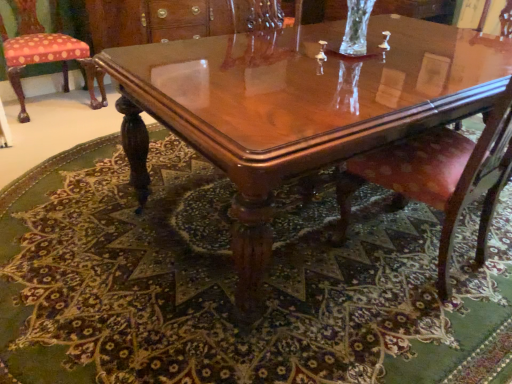
Question: In which direction should I rotate to look at pink velvet chair at center, acting as the second chair starting from the left?

Choices:
 (A) left
 (B) right

Answer: (B)

Question: Does carpeted floor at center have a greater width compared to polka dot fabric cushion at left, which ranks as the second chair in right-to-left order?

Choices:
 (A) yes
 (B) no

Answer: (A)

Question: Is the position of carpeted floor at center less distant than that of polka dot fabric cushion at left, the 2th chair from the front?

Choices:
 (A) yes
 (B) no

Answer: (A)

Question: Can you confirm if carpeted floor at center is thinner than polka dot fabric cushion at left, which appears as the 2th chair when ordered from the bottom?

Choices:
 (A) yes
 (B) no

Answer: (B)

Question: Does carpeted floor at center lie behind polka dot fabric cushion at left, the 1th chair positioned from the left?

Choices:
 (A) yes
 (B) no

Answer: (B)

Question: From a real-world perspective, does carpeted floor at center stand above polka dot fabric cushion at left, the 2th chair from the front?

Choices:
 (A) no
 (B) yes

Answer: (A)

Question: Does carpeted floor at center appear on the right side of polka dot fabric cushion at left, the 1th chair in the back-to-front sequence?

Choices:
 (A) yes
 (B) no

Answer: (A)

Question: Is glossy wood coffee table at center smaller than carpeted floor at center?

Choices:
 (A) yes
 (B) no

Answer: (B)

Question: Is glossy wood coffee table at center bigger than carpeted floor at center?

Choices:
 (A) no
 (B) yes

Answer: (B)

Question: Could you tell me if glossy wood coffee table at center is facing carpeted floor at center?

Choices:
 (A) yes
 (B) no

Answer: (B)

Question: From a real-world perspective, is glossy wood coffee table at center physically above carpeted floor at center?

Choices:
 (A) yes
 (B) no

Answer: (A)

Question: Does glossy wood coffee table at center appear on the right side of carpeted floor at center?

Choices:
 (A) no
 (B) yes

Answer: (B)

Question: From a real-world perspective, is glossy wood coffee table at center under carpeted floor at center?

Choices:
 (A) no
 (B) yes

Answer: (A)

Question: Is polka dot fabric cushion at left, marked as the 1th chair in a top-to-bottom arrangement, looking in the opposite direction of pink velvet chair at center, acting as the second chair starting from the left?

Choices:
 (A) yes
 (B) no

Answer: (B)